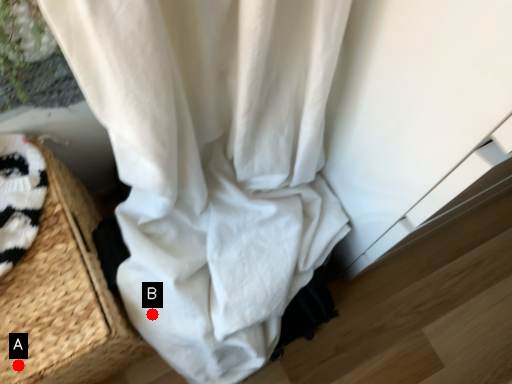
Question: Two points are circled on the image, labeled by A and B beside each circle. Which point is farther to the camera?

Choices:
 (A) A is further
 (B) B is further

Answer: (B)